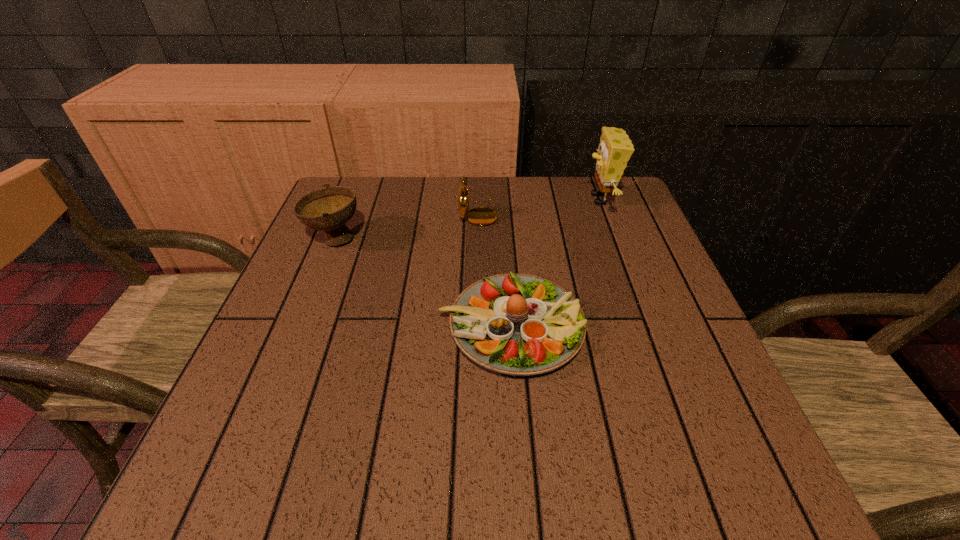
Find the location of a particular element. vacant space that satisfies the following two spatial constraints: 1. on the back side of the salad plate; 2. on the face of the pocket watch is located at coordinates (503, 212).